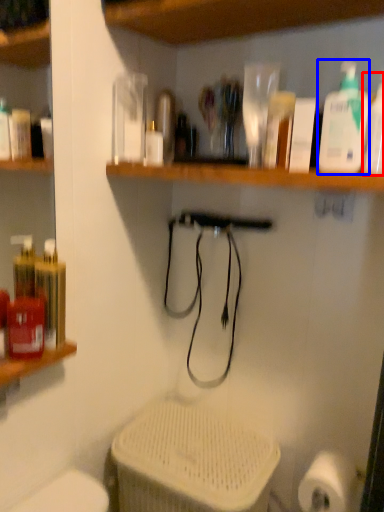
Question: Which object is closer to the camera taking this photo, cleaning product (highlighted by a red box) or cleaning product (highlighted by a blue box)?

Choices:
 (A) cleaning product
 (B) cleaning product

Answer: (A)